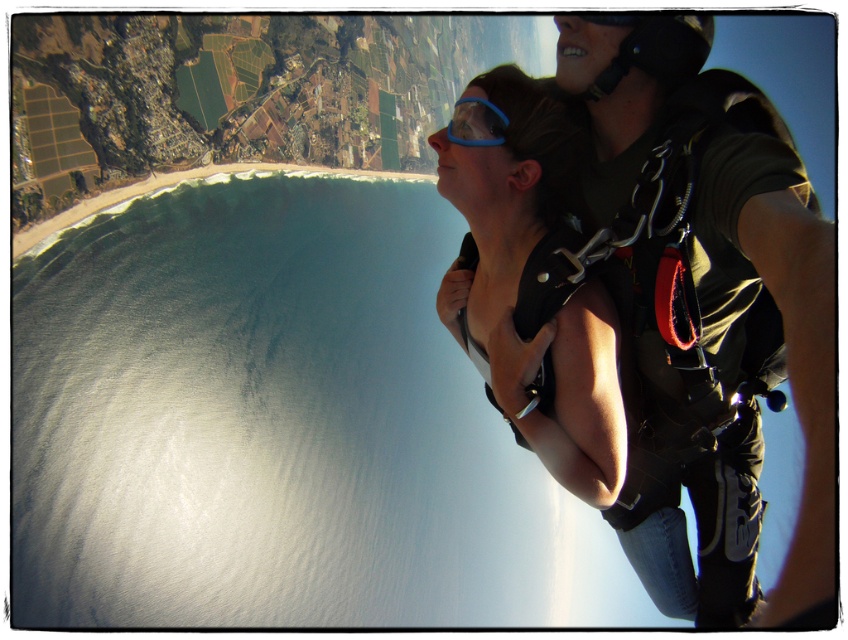
Does matte black harness at center have a lesser height compared to blue rubber goggles at center?

In fact, matte black harness at center may be taller than blue rubber goggles at center.

The height and width of the screenshot is (640, 848). In order to click on matte black harness at center in this screenshot , I will do `click(801, 376)`.